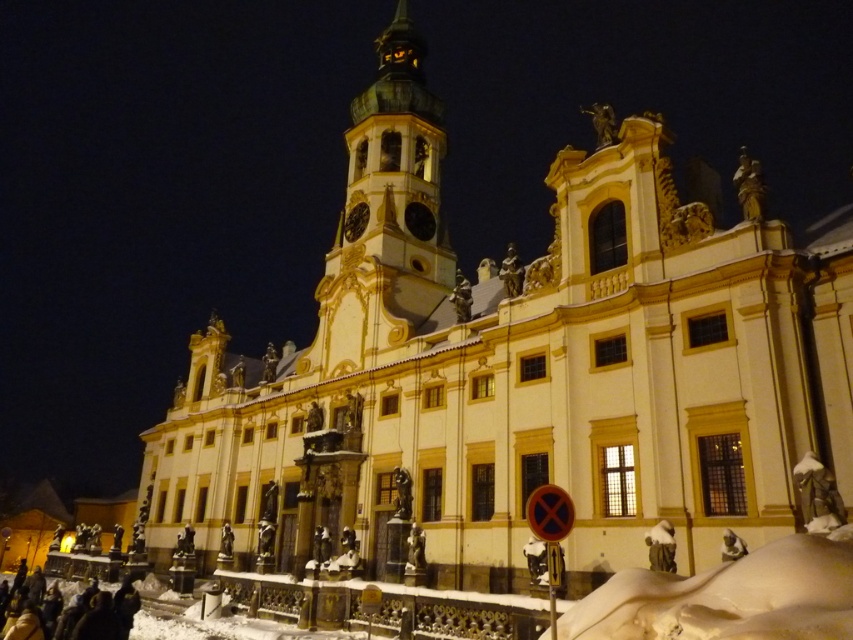
Question: Does white fluffy snow at lower right appear on the left side of dark brown leather coat at lower left?

Choices:
 (A) yes
 (B) no

Answer: (B)

Question: Where is white fluffy snow at lower right located in relation to dark brown leather coat at lower left in the image?

Choices:
 (A) above
 (B) below

Answer: (A)

Question: Does white fluffy snow at lower right appear under dark brown leather coat at lower left?

Choices:
 (A) yes
 (B) no

Answer: (B)

Question: Which point appears closest to the camera in this image?

Choices:
 (A) 128,612
 (B) 810,550

Answer: (B)